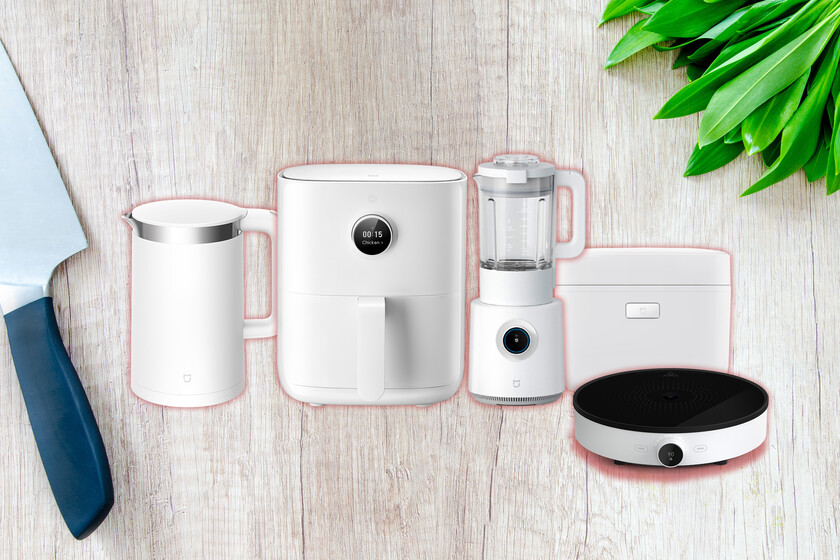
What are the coordinates of `kettle` in the screenshot? It's located at (184, 280).